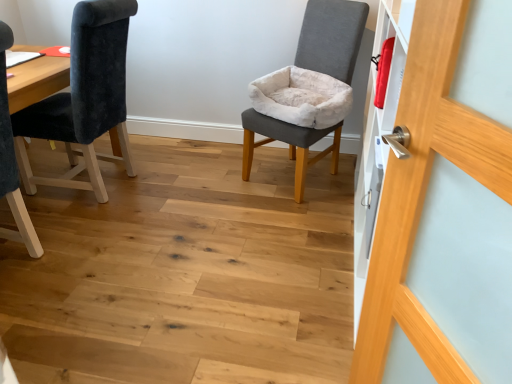
Question: From a real-world perspective, is gray fabric chair at center, placed as the 2th chair when sorted from left to right, over wooden door handle at right?

Choices:
 (A) yes
 (B) no

Answer: (B)

Question: Considering the relative sizes of gray fabric chair at center, placed as the 2th chair when sorted from left to right, and wooden door handle at right in the image provided, is gray fabric chair at center, placed as the 2th chair when sorted from left to right, bigger than wooden door handle at right?

Choices:
 (A) no
 (B) yes

Answer: (B)

Question: Is gray fabric chair at center, the 1th chair viewed from the right, far away from wooden door handle at right?

Choices:
 (A) no
 (B) yes

Answer: (B)

Question: Is gray fabric chair at center, the 1th chair viewed from the right, at the left side of wooden door handle at right?

Choices:
 (A) no
 (B) yes

Answer: (B)

Question: From a real-world perspective, is gray fabric chair at center, the 1th chair viewed from the right, beneath wooden door handle at right?

Choices:
 (A) no
 (B) yes

Answer: (B)

Question: Does gray fabric chair at center, the 1th chair viewed from the right, have a lesser height compared to wooden door handle at right?

Choices:
 (A) no
 (B) yes

Answer: (B)

Question: Could you tell me if velvet dark blue chair at left, which is the 1th chair in left-to-right order, is facing gray fabric chair at center, the 1th chair viewed from the right?

Choices:
 (A) yes
 (B) no

Answer: (B)

Question: Is velvet dark blue chair at left, the 2th chair viewed from the right, smaller than gray fabric chair at center, the 1th chair viewed from the right?

Choices:
 (A) no
 (B) yes

Answer: (B)

Question: Is velvet dark blue chair at left, the 2th chair viewed from the right, wider than gray fabric chair at center, placed as the 2th chair when sorted from left to right?

Choices:
 (A) yes
 (B) no

Answer: (A)

Question: From the image's perspective, is velvet dark blue chair at left, which is the 1th chair in left-to-right order, over gray fabric chair at center, placed as the 2th chair when sorted from left to right?

Choices:
 (A) yes
 (B) no

Answer: (B)

Question: Is velvet dark blue chair at left, the 2th chair viewed from the right, to the left of gray fabric chair at center, placed as the 2th chair when sorted from left to right, from the viewer's perspective?

Choices:
 (A) yes
 (B) no

Answer: (A)

Question: Considering the relative sizes of velvet dark blue chair at left, the 2th chair viewed from the right, and gray fabric chair at center, placed as the 2th chair when sorted from left to right, in the image provided, is velvet dark blue chair at left, the 2th chair viewed from the right, bigger than gray fabric chair at center, placed as the 2th chair when sorted from left to right,?

Choices:
 (A) yes
 (B) no

Answer: (B)

Question: Does wooden door handle at right have a larger size compared to velvet dark blue chair at left, which is the 1th chair in left-to-right order?

Choices:
 (A) no
 (B) yes

Answer: (A)